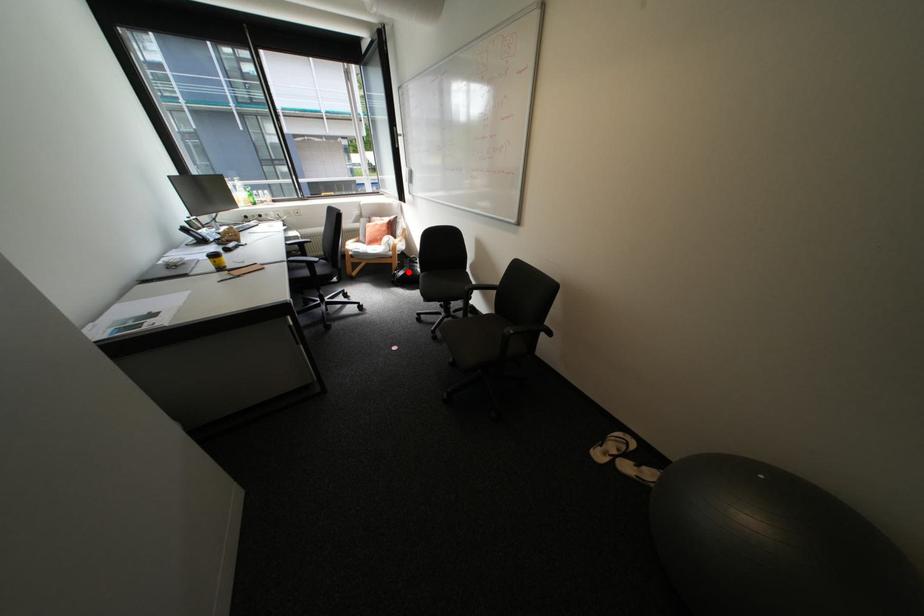
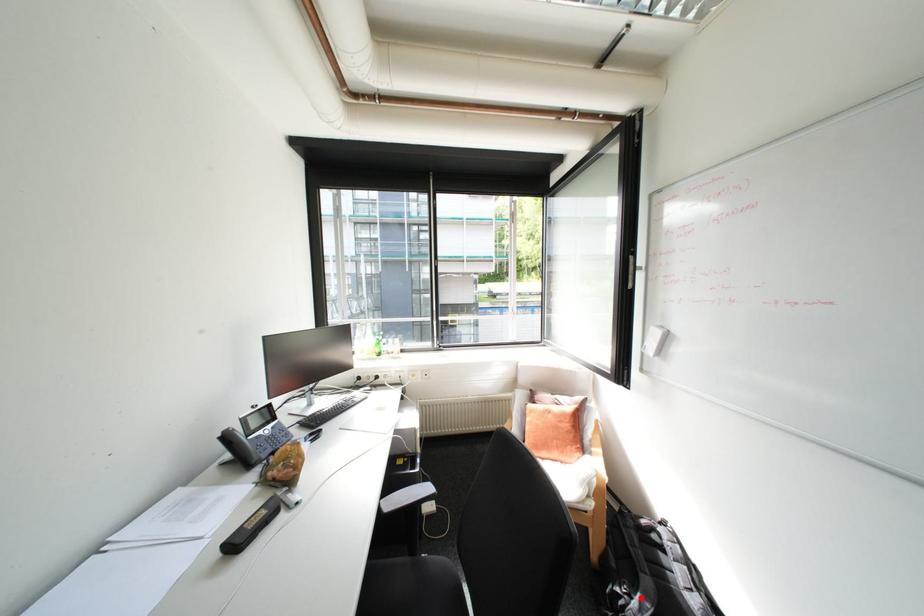
I am providing you with two images of the same scene from different viewpoints. A red point is marked on the first image and another point is marked on the second image. Does the point marked in image1 correspond to the same location as the one in image2?

Yes